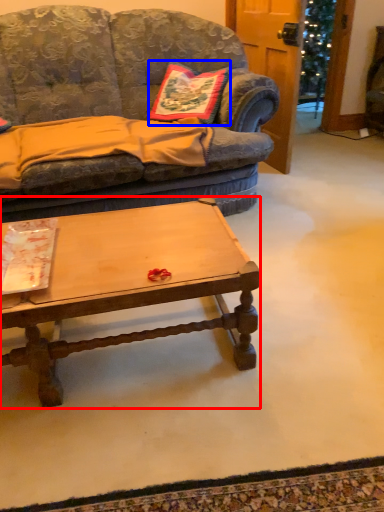
Question: Among these objects, which one is farthest to the camera, coffee table (highlighted by a red box) or pillow (highlighted by a blue box)?

Choices:
 (A) coffee table
 (B) pillow

Answer: (B)